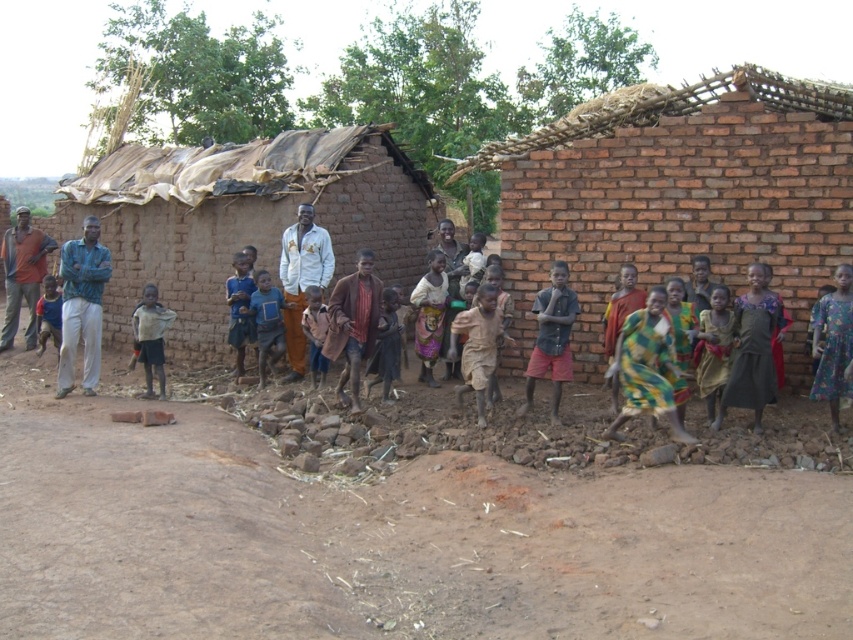
Image resolution: width=853 pixels, height=640 pixels. Describe the element at coordinates (352, 324) in the screenshot. I see `brown textured coat at center` at that location.

Is point (347, 404) positioned behind point (263, 282)?

No.

Where is `brown textured coat at center`? The image size is (853, 640). brown textured coat at center is located at coordinates [352, 324].

The height and width of the screenshot is (640, 853). I want to click on brown textured coat at center, so click(352, 324).

Is green and yellow fabric dress at center bigger than green fabric shirt at left?

Actually, green and yellow fabric dress at center might be smaller than green fabric shirt at left.

Who is higher up, green and yellow fabric dress at center or green fabric shirt at left?

green fabric shirt at left

Describe the element at coordinates (647, 368) in the screenshot. The width and height of the screenshot is (853, 640). I see `green and yellow fabric dress at center` at that location.

I want to click on green and yellow fabric dress at center, so click(647, 368).

Who is shorter, green fabric shirt at left or blue fabric book at center?

blue fabric book at center

How much distance is there between green fabric shirt at left and blue fabric book at center?

They are 5.92 feet apart.

Is point (96, 234) closer to camera compared to point (257, 328)?

Yes, it is.

At what (x,y) coordinates should I click in order to perform the action: click on green fabric shirt at left. Please return your answer as a coordinate pair (x, y). The height and width of the screenshot is (640, 853). Looking at the image, I should click on (82, 305).